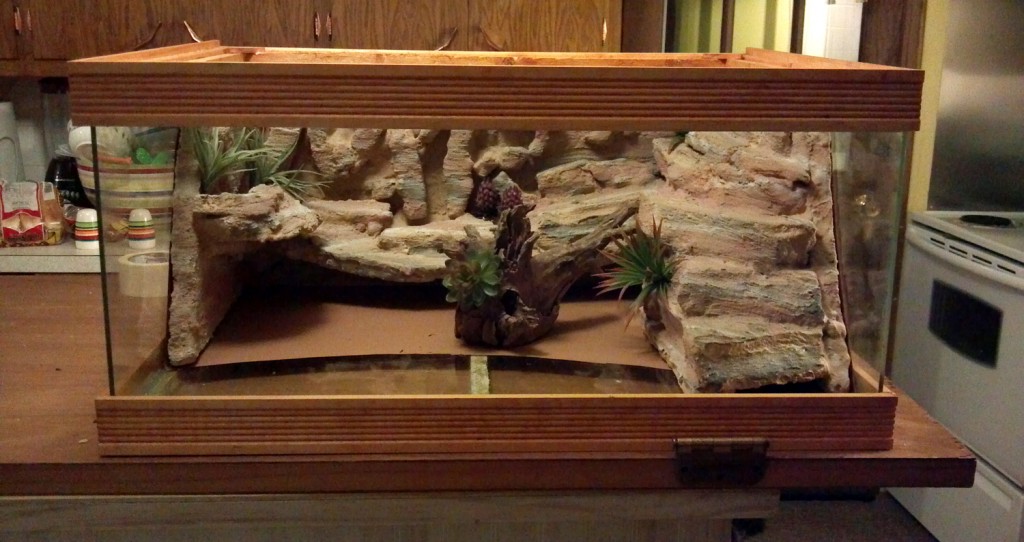
Locate an element on the screen. oven is located at coordinates (968, 332).